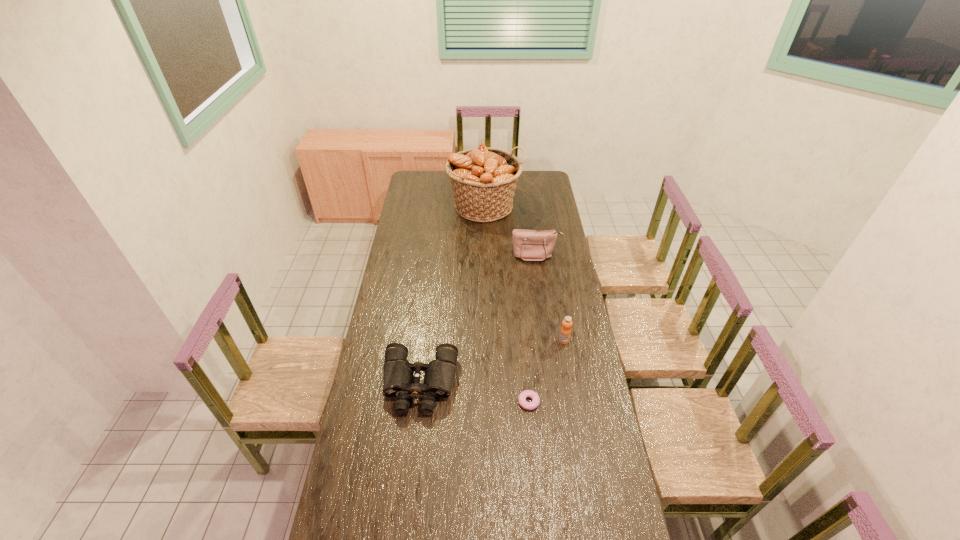
The image size is (960, 540). I want to click on vacant region between the second farthest object and the third farthest object, so click(x=550, y=298).

Identify the location of vacant space that is in between the orange juice and the farthest object. This screenshot has width=960, height=540. tap(525, 273).

At what (x,y) coordinates should I click in order to perform the action: click on free space between the second shortest object and the fourth nearest object. Please return your answer as a coordinate pair (x, y). This screenshot has height=540, width=960. Looking at the image, I should click on (478, 320).

At what (x,y) coordinates should I click in order to perform the action: click on free space between the fourth nearest object and the second shortest object. Please return your answer as a coordinate pair (x, y). Image resolution: width=960 pixels, height=540 pixels. Looking at the image, I should click on (478, 320).

The width and height of the screenshot is (960, 540). Identify the location of vacant region between the orange juice and the tallest object. (525, 273).

The width and height of the screenshot is (960, 540). In order to click on free spot between the shortest object and the farthest object in this screenshot , I will do `click(507, 304)`.

Where is `free point between the second farthest object and the third farthest object`? free point between the second farthest object and the third farthest object is located at coordinates (550, 298).

What are the coordinates of `vacant area that lies between the binoculars and the doughnut` in the screenshot? It's located at (474, 393).

Find the location of a particular element. object that can be found as the fourth closest to the second farthest object is located at coordinates (523, 395).

Select which object appears as the second closest to the shortest object. Please provide its 2D coordinates. Your answer should be formatted as a tuple, i.e. [(x, y)], where the tuple contains the x and y coordinates of a point satisfying the conditions above.

[(565, 332)]